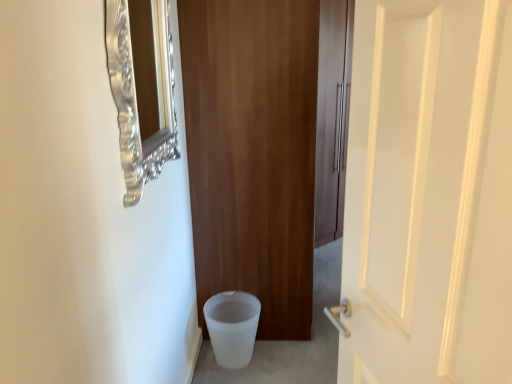
Question: Can you confirm if white frosted potty at lower left is positioned to the right of wooden door at center, the 1th door viewed from the back?

Choices:
 (A) yes
 (B) no

Answer: (B)

Question: From a real-world perspective, does white frosted potty at lower left stand above wooden door at center, the 2th door viewed from the front?

Choices:
 (A) no
 (B) yes

Answer: (A)

Question: Is wooden door at center, the 2th door viewed from the front, inside white frosted potty at lower left?

Choices:
 (A) no
 (B) yes

Answer: (A)

Question: Is white frosted potty at lower left shorter than wooden door at center, the 2th door viewed from the front?

Choices:
 (A) no
 (B) yes

Answer: (B)

Question: Is white frosted potty at lower left bigger than wooden door at center, the 1th door viewed from the back?

Choices:
 (A) yes
 (B) no

Answer: (B)

Question: From their relative heights in the image, would you say silver ornate mirror at upper left is taller or shorter than white frosted potty at lower left?

Choices:
 (A) tall
 (B) short

Answer: (A)

Question: Visually, is silver ornate mirror at upper left positioned to the left or to the right of white frosted potty at lower left?

Choices:
 (A) right
 (B) left

Answer: (B)

Question: Would you say silver ornate mirror at upper left is inside or outside white frosted potty at lower left?

Choices:
 (A) inside
 (B) outside

Answer: (B)

Question: Is point [x=157, y=61] positioned closer to the camera than point [x=252, y=345]?

Choices:
 (A) farther
 (B) closer

Answer: (B)

Question: From the image's perspective, is white frosted potty at lower left positioned above or below silver ornate mirror at upper left?

Choices:
 (A) below
 (B) above

Answer: (A)

Question: Is white frosted potty at lower left spatially inside silver ornate mirror at upper left, or outside of it?

Choices:
 (A) inside
 (B) outside

Answer: (B)

Question: Looking at their shapes, would you say white frosted potty at lower left is wider or thinner than silver ornate mirror at upper left?

Choices:
 (A) wide
 (B) thin

Answer: (A)

Question: From a real-world perspective, is white frosted potty at lower left physically located above or below silver ornate mirror at upper left?

Choices:
 (A) below
 (B) above

Answer: (A)

Question: Based on their sizes in the image, would you say white glossy door at right, the first door viewed from the front, is bigger or smaller than white frosted potty at lower left?

Choices:
 (A) small
 (B) big

Answer: (B)

Question: From a real-world perspective, is white glossy door at right, the first door viewed from the front, positioned above or below white frosted potty at lower left?

Choices:
 (A) below
 (B) above

Answer: (B)